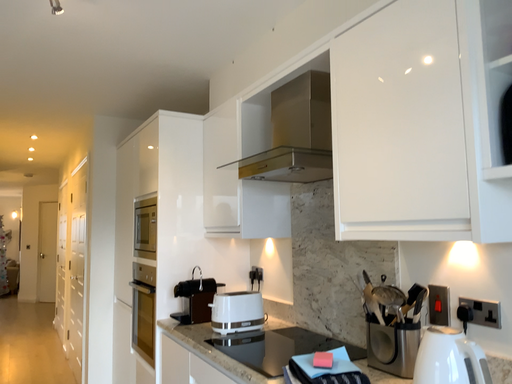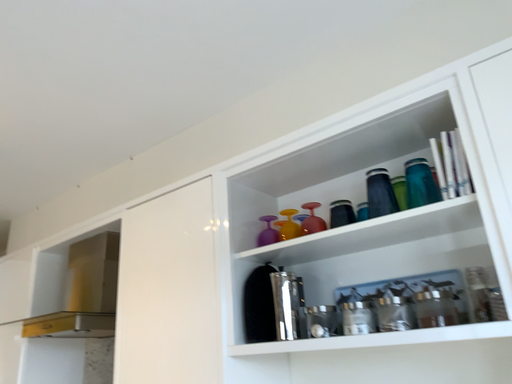
Question: How did the camera likely rotate when shooting the video?

Choices:
 (A) rotated left
 (B) rotated right

Answer: (B)